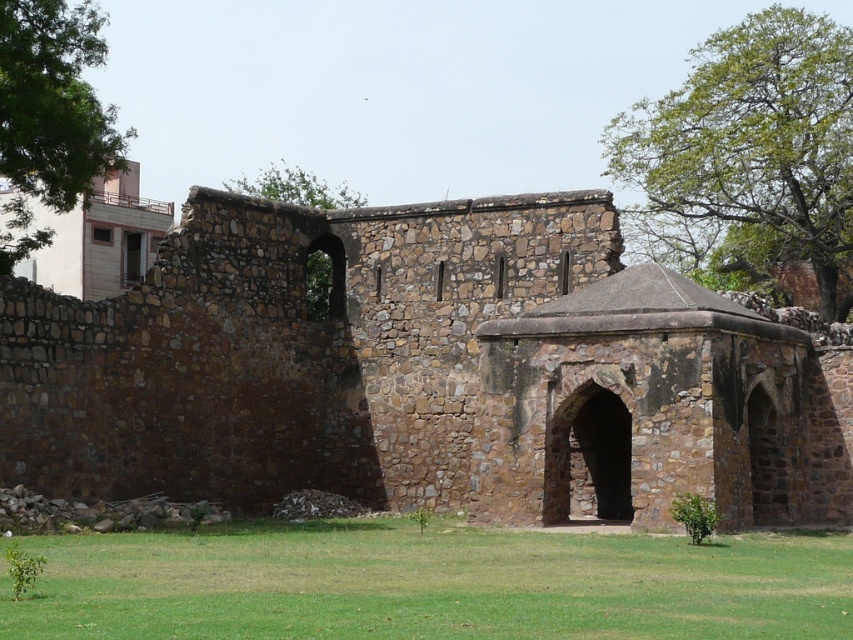
How distant is rustic stone church at center from green grass at lower center?

They are 10.32 meters apart.

Is rustic stone church at center to the right of green grass at lower center from the viewer's perspective?

Yes, rustic stone church at center is to the right of green grass at lower center.

What do you see at coordinates (422, 371) in the screenshot? This screenshot has width=853, height=640. I see `rustic stone church at center` at bounding box center [422, 371].

Where is `rustic stone church at center`? The image size is (853, 640). rustic stone church at center is located at coordinates (422, 371).

Consider the image. Is green grass at lower center above green leafy tree at upper right?

No.

Which of these two, green grass at lower center or green leafy tree at upper right, stands shorter?

green grass at lower center

Where is `green grass at lower center`? The width and height of the screenshot is (853, 640). green grass at lower center is located at coordinates (428, 582).

Identify the location of green grass at lower center. This screenshot has width=853, height=640. (428, 582).

Is rustic stone church at center wider than green leafy tree at upper right?

In fact, rustic stone church at center might be narrower than green leafy tree at upper right.

Can you confirm if rustic stone church at center is positioned below green leafy tree at upper right?

Yes.

This screenshot has height=640, width=853. Describe the element at coordinates (422, 371) in the screenshot. I see `rustic stone church at center` at that location.

Image resolution: width=853 pixels, height=640 pixels. Identify the location of rustic stone church at center. (422, 371).